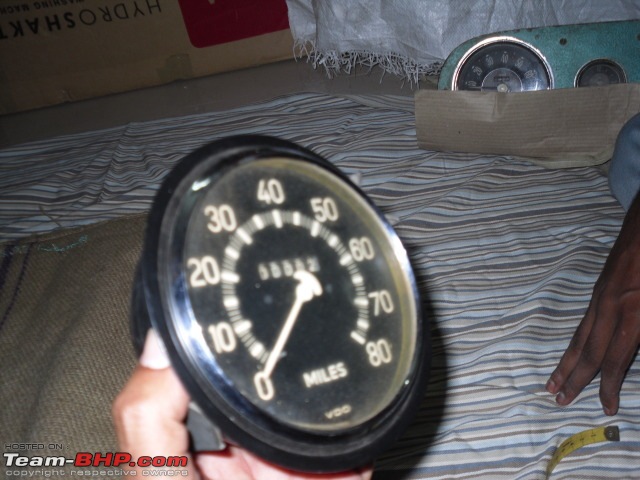
Where is `green woven cloth`? green woven cloth is located at coordinates (76, 382).